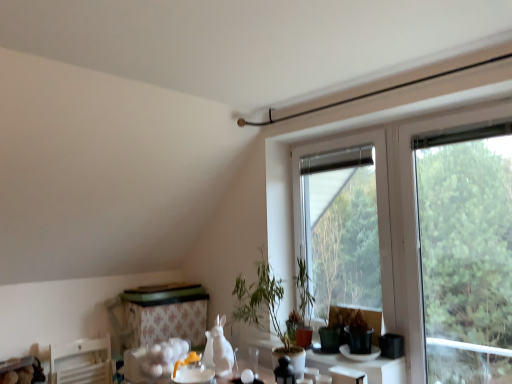
What do you see at coordinates (291, 359) in the screenshot?
I see `transparent glass vase at lower center` at bounding box center [291, 359].

Find the location of a particular element. green matte plant at center is located at coordinates point(265,307).

Measure the distance between green matte plant at center and camera.

green matte plant at center is 7.45 feet from camera.

What do you see at coordinates (345, 223) in the screenshot? I see `transparent glass window at center` at bounding box center [345, 223].

This screenshot has width=512, height=384. What do you see at coordinates (165, 313) in the screenshot? I see `floral-patterned fabric at lower center` at bounding box center [165, 313].

Where is `transparent glass vase at lower center`? The image size is (512, 384). transparent glass vase at lower center is located at coordinates (291, 359).

Is green matte plant at center turned away from transparent glass vase at lower center?

That's not correct — green matte plant at center is not looking away from transparent glass vase at lower center.

Does point (302, 361) appear closer or farther from the camera than point (294, 363)?

Point (302, 361) is farther from the camera than point (294, 363).

Are green matte plant at center and transparent glass vase at lower center beside each other?

No, green matte plant at center is not beside transparent glass vase at lower center.

Locate an element on the screen. The width and height of the screenshot is (512, 384). houseplant above the transparent glass vase at lower center (from the image's perspective) is located at coordinates (265, 307).

Which object is thinner, transparent glass vase at lower center or green leafy tree at right?

Thinner between the two is green leafy tree at right.

Is transparent glass vase at lower center located outside green leafy tree at right?

Absolutely, transparent glass vase at lower center is external to green leafy tree at right.

Considering the positions of points (296, 360) and (511, 326), is point (296, 360) closer to camera compared to point (511, 326)?

Yes, it is in front of point (511, 326).

From the image's perspective, which one is positioned lower, green leafy tree at right or green matte plant at center?

green matte plant at center is shown below in the image.

Could you tell me if green leafy tree at right is turned towards green matte plant at center?

No, green leafy tree at right is not oriented towards green matte plant at center.

What's the angular difference between green leafy tree at right and green matte plant at center's facing directions?

There is a 0.799-degree angle between the facing directions of green leafy tree at right and green matte plant at center.

Considering the points (481, 310) and (292, 363), which point is behind, point (481, 310) or point (292, 363)?

The point (481, 310) is farther.

Can you confirm if green leafy tree at right is smaller than floral-patterned fabric at lower center?

No.

Looking at this image, what's the angular difference between green leafy tree at right and floral-patterned fabric at lower center's facing directions?

The angular difference between green leafy tree at right and floral-patterned fabric at lower center is 85.5 degrees.

Is floral-patterned fabric at lower center located within green leafy tree at right?

No, green leafy tree at right does not contain floral-patterned fabric at lower center.

From the image's perspective, would you say green leafy tree at right is shown under floral-patterned fabric at lower center?

No, from the image's perspective, green leafy tree at right is not below floral-patterned fabric at lower center.

Find the location of a particular element. Image resolution: width=512 pixels, height=384 pixels. tree in front of the green matte plant at center is located at coordinates (466, 240).

Can you confirm if green matte plant at center is positioned to the right of green leafy tree at right?

No.

From a real-world perspective, is green matte plant at center physically located above or below green leafy tree at right?

green matte plant at center is below green leafy tree at right.

Based on their sizes in the image, would you say floral-patterned fabric at lower center is bigger or smaller than transparent glass window at center?

In the image, floral-patterned fabric at lower center appears to be larger than transparent glass window at center.

From a real-world perspective, is floral-patterned fabric at lower center over transparent glass window at center?

Actually, floral-patterned fabric at lower center is physically below transparent glass window at center in the real world.

Choose the correct answer: Is floral-patterned fabric at lower center inside transparent glass window at center or outside it?

floral-patterned fabric at lower center exists outside the volume of transparent glass window at center.

Can you confirm if floral-patterned fabric at lower center is shorter than transparent glass window at center?

Yes.

Would you say transparent glass vase at lower center is part of transparent glass window at center's contents?

Actually, transparent glass vase at lower center is outside transparent glass window at center.

From a real-world perspective, which is physically below, transparent glass window at center or transparent glass vase at lower center?

transparent glass vase at lower center.

From the image's perspective, is transparent glass window at center below transparent glass vase at lower center?

No.

Find the location of a particular element. The width and height of the screenshot is (512, 384). houseplant in front of the transparent glass vase at lower center is located at coordinates (265, 307).

Locate an element on the screen. glass vase located on the left of green leafy tree at right is located at coordinates (291, 359).

From the image, which object appears to be nearer to transparent glass window at center, transparent glass vase at lower center or green leafy tree at right?

green leafy tree at right lies closer to transparent glass window at center than the other object.

Looking at the image, which one is located closer to floral-patterned fabric at lower center, green leafy tree at right or green matte plant at center?

green matte plant at center lies closer to floral-patterned fabric at lower center than the other object.

Looking at the image, which one is located closer to floral-patterned fabric at lower center, transparent glass window at center or green matte plant at center?

green matte plant at center is positioned closer to the anchor floral-patterned fabric at lower center.

Considering their positions, is green leafy tree at right positioned closer to transparent glass window at center than transparent glass vase at lower center?

green leafy tree at right is closer to transparent glass window at center.

Looking at the image, which one is located closer to transparent glass vase at lower center, green leafy tree at right or green matte plant at center?

green matte plant at center is positioned closer to the anchor transparent glass vase at lower center.

Looking at the image, which one is located closer to green leafy tree at right, transparent glass vase at lower center or floral-patterned fabric at lower center?

Among the two, transparent glass vase at lower center is located nearer to green leafy tree at right.

Consider the image. When comparing their distances from green leafy tree at right, does transparent glass vase at lower center or transparent glass window at center seem closer?

transparent glass window at center lies closer to green leafy tree at right than the other object.

Considering their positions, is transparent glass vase at lower center positioned further to green leafy tree at right than green matte plant at center?

transparent glass vase at lower center.

The width and height of the screenshot is (512, 384). Find the location of `houseplant between floral-patterned fabric at lower center and green leafy tree at right in the horizontal direction`. houseplant between floral-patterned fabric at lower center and green leafy tree at right in the horizontal direction is located at coordinates (265, 307).

I want to click on bay window situated between green matte plant at center and green leafy tree at right from left to right, so click(345, 223).

Find the location of a particular element. This screenshot has height=384, width=512. glass vase located between green matte plant at center and floral-patterned fabric at lower center in the depth direction is located at coordinates (291, 359).

The height and width of the screenshot is (384, 512). What are the coordinates of `glass vase between green matte plant at center and green leafy tree at right` in the screenshot? It's located at (291, 359).